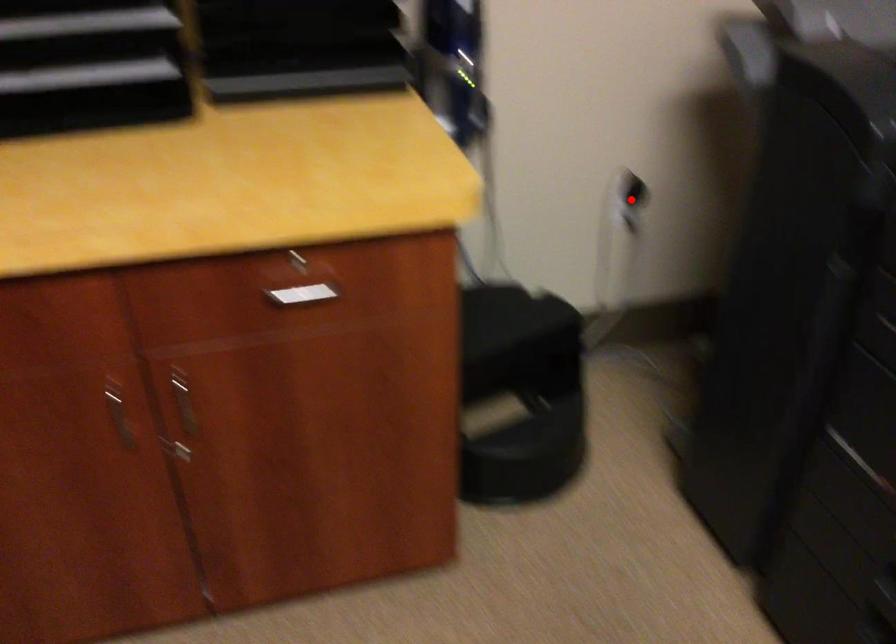
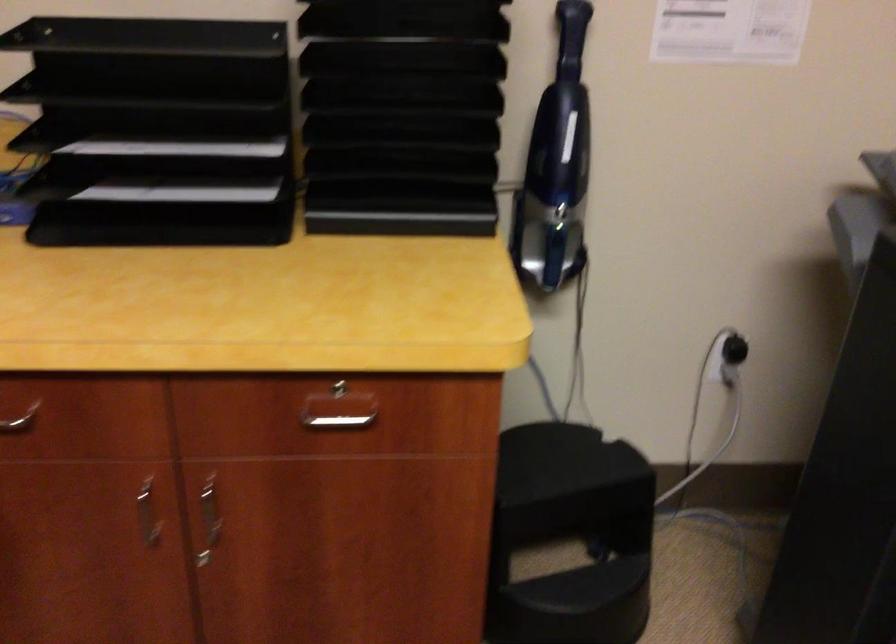
Where in the second image is the point corresponding to the highlighted location from the first image?

(730, 357)